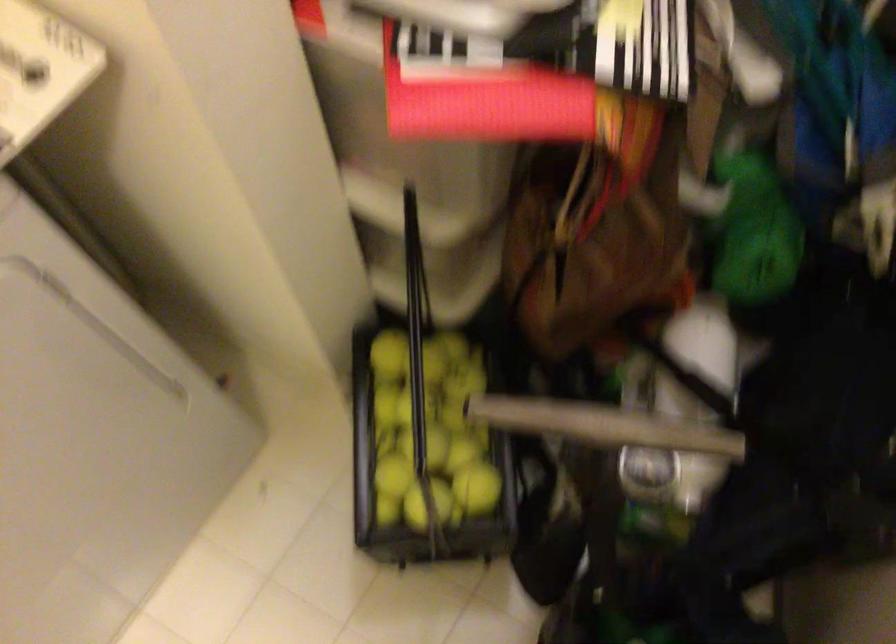
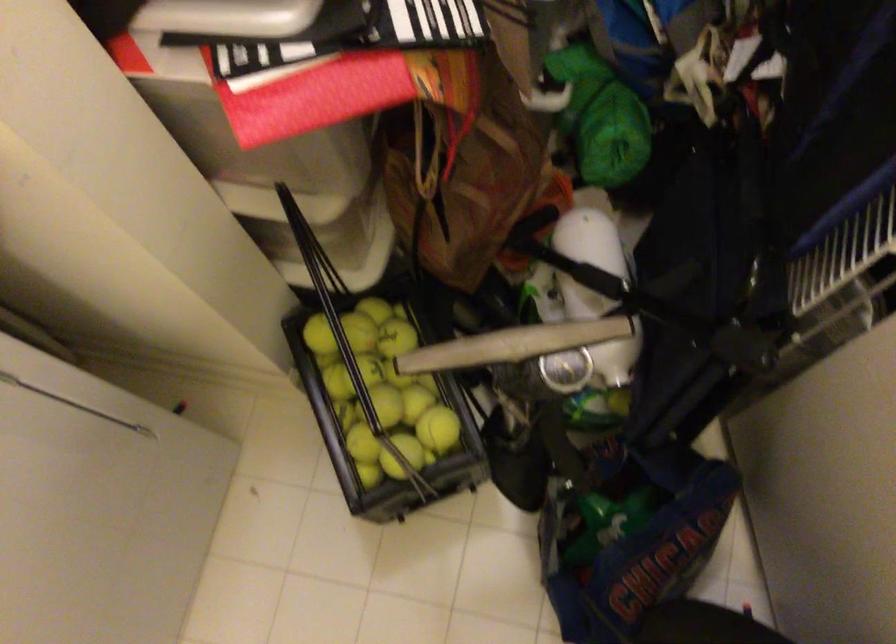
Where in the second image is the point corresponding to [426,453] from the first image?

(383, 408)